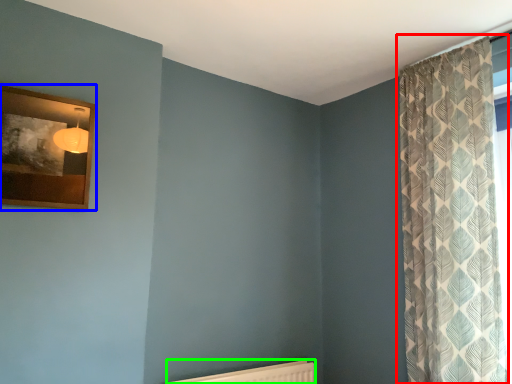
Question: Which is farther away from curtain (highlighted by a red box)? picture frame (highlighted by a blue box) or radiator (highlighted by a green box)?

Choices:
 (A) picture frame
 (B) radiator

Answer: (A)